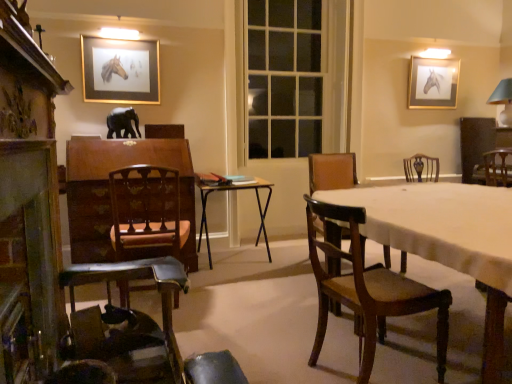
Question: Would you say gold-framed picture of horse at upper right, positioned as the 1th picture frame in right-to-left order, contains wooden chair at right, the first chair viewed from the back?

Choices:
 (A) yes
 (B) no

Answer: (B)

Question: Is gold-framed picture of horse at upper right, which is the 1th picture frame in back-to-front order, far from wooden chair at right, the first chair viewed from the back?

Choices:
 (A) no
 (B) yes

Answer: (A)

Question: Is gold-framed picture of horse at upper right, marked as the second picture frame in a front-to-back arrangement, smaller than wooden chair at right, which is counted as the 5th chair, starting from the front?

Choices:
 (A) yes
 (B) no

Answer: (A)

Question: Is gold-framed picture of horse at upper right, which is the 1th picture frame in back-to-front order, bigger than wooden chair at right, which is counted as the 5th chair, starting from the front?

Choices:
 (A) no
 (B) yes

Answer: (A)

Question: Does gold-framed picture of horse at upper right, which is the second picture frame from left to right, have a lesser width compared to wooden chair at right, the first chair viewed from the back?

Choices:
 (A) yes
 (B) no

Answer: (A)

Question: Can you confirm if gold-framed picture of horse at upper right, which is the 1th picture frame in back-to-front order, is positioned to the right of wooden chair at right, positioned as the first chair in right-to-left order?

Choices:
 (A) yes
 (B) no

Answer: (B)

Question: Does brown leather chair at center, positioned as the 4th chair in front-to-back order, appear on the right side of black matte elephant at center?

Choices:
 (A) yes
 (B) no

Answer: (A)

Question: Is black matte elephant at center completely or partially inside brown leather chair at center, the second chair viewed from the right?

Choices:
 (A) yes
 (B) no

Answer: (B)

Question: From a real-world perspective, is brown leather chair at center, the second chair viewed from the right, located higher than black matte elephant at center?

Choices:
 (A) yes
 (B) no

Answer: (B)

Question: Is brown leather chair at center, positioned as the 4th chair in front-to-back order, oriented towards black matte elephant at center?

Choices:
 (A) yes
 (B) no

Answer: (B)

Question: Considering the relative sizes of brown leather chair at center, the 4th chair positioned from the left, and black matte elephant at center in the image provided, is brown leather chair at center, the 4th chair positioned from the left, smaller than black matte elephant at center?

Choices:
 (A) no
 (B) yes

Answer: (A)

Question: Considering the relative sizes of brown leather chair at center, the second chair in the back-to-front sequence, and black matte elephant at center in the image provided, is brown leather chair at center, the second chair in the back-to-front sequence, shorter than black matte elephant at center?

Choices:
 (A) yes
 (B) no

Answer: (B)

Question: Does metallic silver table at center turn towards wooden chair at left, the fifth chair from the right?

Choices:
 (A) no
 (B) yes

Answer: (A)